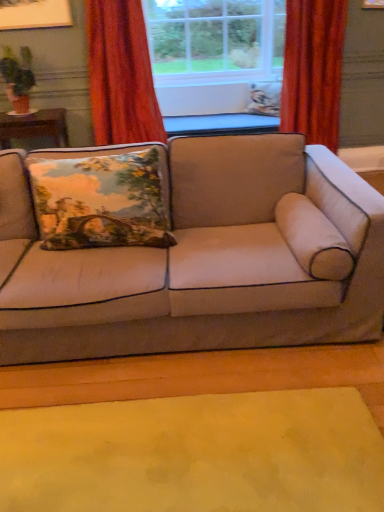
Question: Does point (94, 229) appear closer or farther from the camera than point (249, 84)?

Choices:
 (A) closer
 (B) farther

Answer: (A)

Question: From a real-world perspective, relative to floral fabric pillow at center, which is counted as the second pillow, starting from the front, is velvet floral pillow at left, the first pillow from the front, vertically above or below?

Choices:
 (A) above
 (B) below

Answer: (B)

Question: Estimate the real-world distances between objects in this image. Which object is farther from the clear glass window at center?

Choices:
 (A) velvet floral pillow at left, which is the first pillow in bottom-to-top order
 (B) matte brown pot at left
 (C) beige fabric couch at center
 (D) yellow felt mat at lower center
 (E) floral fabric pillow at center, placed as the 2th pillow when sorted from bottom to top

Answer: (D)

Question: Which object is the farthest from the floral fabric pillow at center, which appears as the 2th pillow when viewed from the left?

Choices:
 (A) velvet floral pillow at left, the 2th pillow viewed from the right
 (B) yellow felt mat at lower center
 (C) beige fabric couch at center
 (D) velvet orange curtain at upper left, the second curtain when ordered from right to left
 (E) velvet-like red curtain at right, positioned as the second curtain in left-to-right order

Answer: (B)